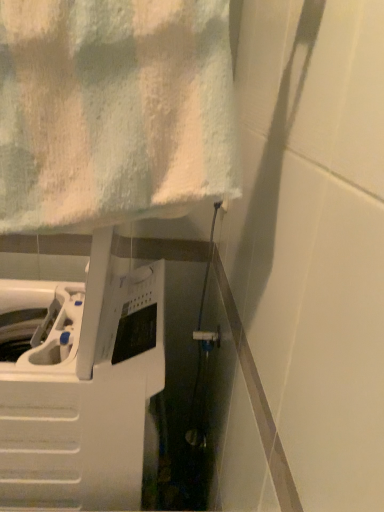
What are the coordinates of `white textured towel at upper left` in the screenshot? It's located at (113, 110).

Describe the element at coordinates (113, 110) in the screenshot. I see `white textured towel at upper left` at that location.

From the picture: What is the approximate height of white textured towel at upper left?

It is 13.65 inches.

I want to click on white plastic washing machine at left, so click(x=82, y=387).

This screenshot has height=512, width=384. What do you see at coordinates (82, 387) in the screenshot?
I see `white plastic washing machine at left` at bounding box center [82, 387].

I want to click on white textured towel at upper left, so click(x=113, y=110).

Which object is positioned more to the right, white plastic washing machine at left or white textured towel at upper left?

white textured towel at upper left.

Is white plastic washing machine at left in front of or behind white textured towel at upper left in the image?

Clearly, white plastic washing machine at left is behind white textured towel at upper left.

Which is more distant, (x=93, y=370) or (x=117, y=2)?

The point (x=93, y=370) is farther from the camera.

From the image's perspective, is white plastic washing machine at left located beneath white textured towel at upper left?

Yes, from the image's perspective, white plastic washing machine at left is below white textured towel at upper left.

From a real-world perspective, who is located higher, white plastic washing machine at left or white textured towel at upper left?

white textured towel at upper left.

Considering the relative sizes of white plastic washing machine at left and white textured towel at upper left in the image provided, is white plastic washing machine at left thinner than white textured towel at upper left?

No, white plastic washing machine at left is not thinner than white textured towel at upper left.

Between white plastic washing machine at left and white textured towel at upper left, which one has less height?

With less height is white textured towel at upper left.

Is white plastic washing machine at left bigger than white textured towel at upper left?

Correct, white plastic washing machine at left is larger in size than white textured towel at upper left.

Choose the correct answer: Is white plastic washing machine at left inside white textured towel at upper left or outside it?

white plastic washing machine at left is spatially situated outside white textured towel at upper left.

Are white plastic washing machine at left and white textured towel at upper left located far from each other?

No, white plastic washing machine at left is in close proximity to white textured towel at upper left.

Could you tell me if white plastic washing machine at left is turned towards white textured towel at upper left?

No.

Locate an element on the screen. This screenshot has width=384, height=512. towel on the right of white plastic washing machine at left is located at coordinates (113, 110).

Considering the positions of objects white textured towel at upper left and white plastic washing machine at left in the image provided, who is more to the left, white textured towel at upper left or white plastic washing machine at left?

From the viewer's perspective, white plastic washing machine at left appears more on the left side.

Consider the image. In the image, is white textured towel at upper left positioned in front of or behind white plastic washing machine at left?

white textured towel at upper left is in front of white plastic washing machine at left.

Between point (201, 12) and point (21, 364), which one is positioned in front?

Positioned in front is point (201, 12).

From the image's perspective, which one is positioned higher, white textured towel at upper left or white plastic washing machine at left?

white textured towel at upper left.

From a real-world perspective, is white textured towel at upper left beneath white plastic washing machine at left?

No, from a real-world perspective, white textured towel at upper left is not under white plastic washing machine at left.

Which object is thinner, white textured towel at upper left or white plastic washing machine at left?

white textured towel at upper left is thinner.

Which of these two, white textured towel at upper left or white plastic washing machine at left, stands shorter?

white textured towel at upper left.

Can you confirm if white textured towel at upper left is smaller than white plastic washing machine at left?

Correct, white textured towel at upper left occupies less space than white plastic washing machine at left.

Is white plastic washing machine at left inside white textured towel at upper left?

No.

Can you see white textured towel at upper left touching white plastic washing machine at left?

No, white textured towel at upper left is not next to white plastic washing machine at left.

Could you tell me if white textured towel at upper left is facing white plastic washing machine at left?

No, white textured towel at upper left does not turn towards white plastic washing machine at left.

Where is `appliance to the left of white textured towel at upper left`? The image size is (384, 512). appliance to the left of white textured towel at upper left is located at coordinates (82, 387).

Where is `appliance that is below the white textured towel at upper left (from the image's perspective)`? appliance that is below the white textured towel at upper left (from the image's perspective) is located at coordinates coord(82,387).

You are a GUI agent. You are given a task and a screenshot of the screen. Output one action in this format:
    pyautogui.click(x=<x>, y=<y>)
    Task: Click on the appliance behind the white textured towel at upper left
    Image resolution: width=384 pixels, height=512 pixels.
    Given the screenshot: What is the action you would take?
    pyautogui.click(x=82, y=387)